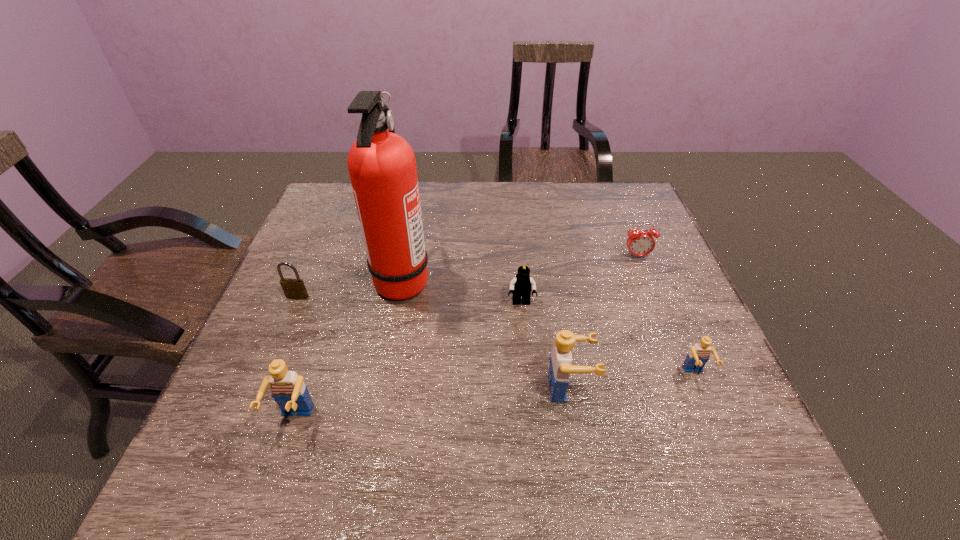
The image size is (960, 540). What are the coordinates of `the sixth object from right to left` in the screenshot? It's located at (287, 388).

This screenshot has height=540, width=960. Identify the location of the third shortest Lego. (287, 388).

Identify the location of the third object from right to left. The height and width of the screenshot is (540, 960). (560, 360).

The height and width of the screenshot is (540, 960). Find the location of `the rightmost Lego`. the rightmost Lego is located at coordinates (698, 356).

Locate an element on the screen. padlock is located at coordinates (293, 288).

I want to click on alarm clock, so click(x=640, y=243).

The width and height of the screenshot is (960, 540). I want to click on the fourth object from left to right, so pyautogui.click(x=522, y=285).

I want to click on the farthest Lego, so click(x=522, y=285).

Where is `fire extinguisher`? fire extinguisher is located at coordinates (382, 167).

Where is `the tallest object`? This screenshot has height=540, width=960. the tallest object is located at coordinates (382, 167).